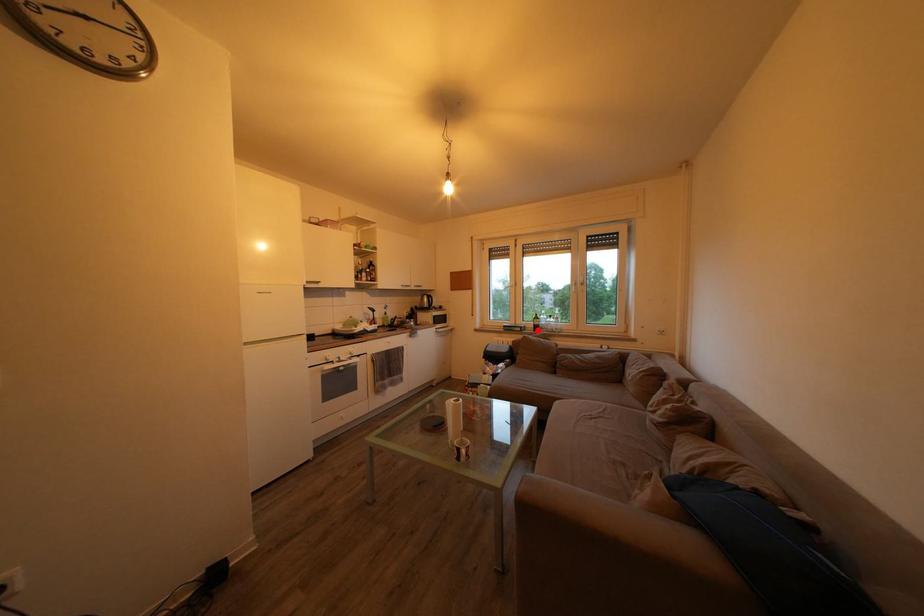
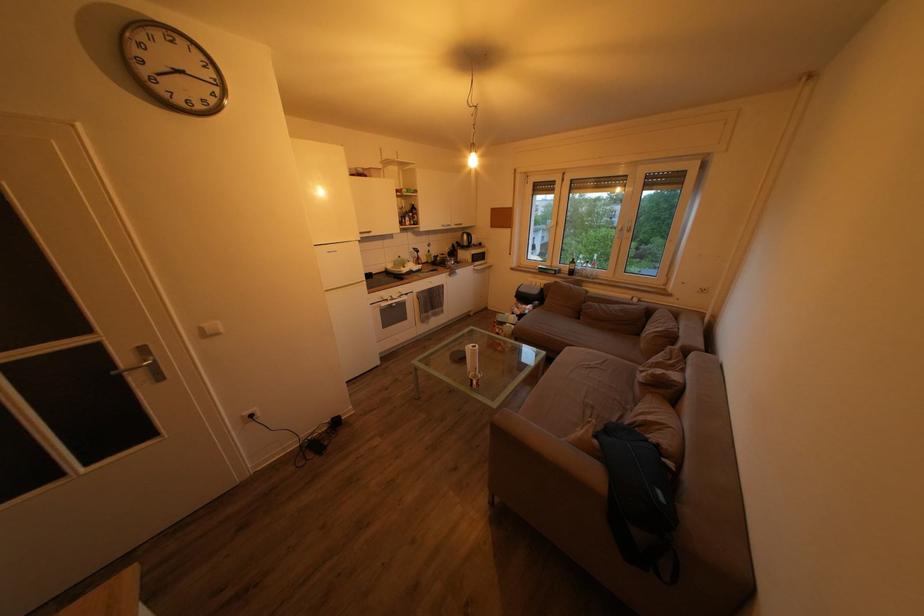
Find the pixel in the second image that matches the highlighted location in the first image.

(573, 274)